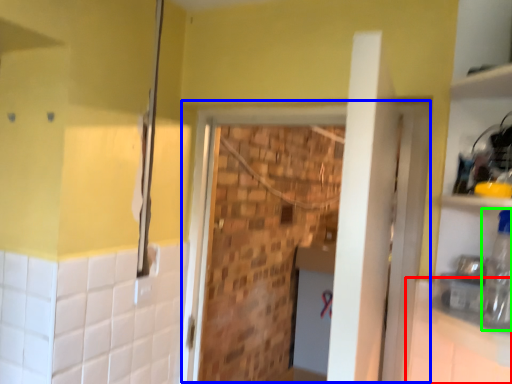
Question: Based on their relative distances, which object is nearer to counter top (highlighted by a red box)? Choose from screen door (highlighted by a blue box) and bottle (highlighted by a green box).

Choices:
 (A) screen door
 (B) bottle

Answer: (B)